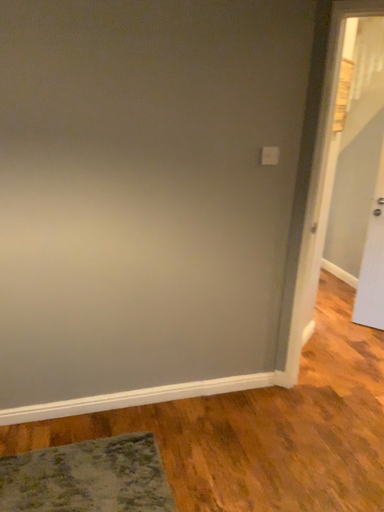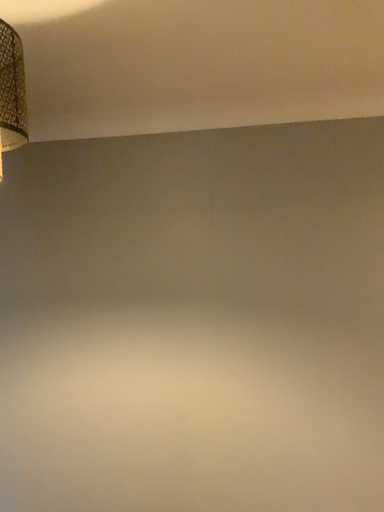
Question: How did the camera likely rotate when shooting the video?

Choices:
 (A) rotated right
 (B) rotated left

Answer: (B)